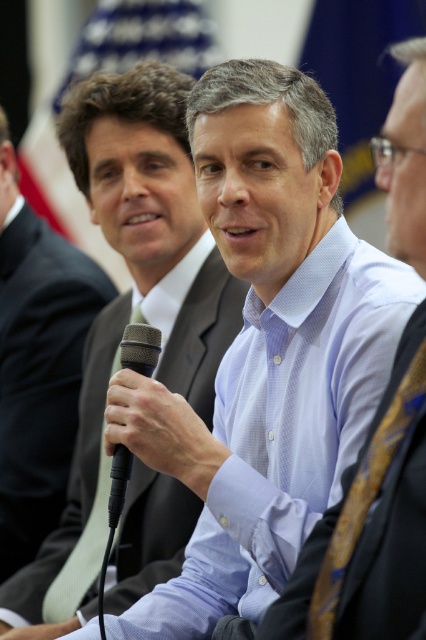
Question: Considering the relative positions of dark gray suit at center and matte black microphone at center in the image provided, where is dark gray suit at center located with respect to matte black microphone at center?

Choices:
 (A) left
 (B) right

Answer: (B)

Question: Considering the real-world distances, which object is farthest from the dark gray suit at center?

Choices:
 (A) light blue textured shirt at center
 (B) black matte microphone at center
 (C) matte black microphone at center

Answer: (A)

Question: Considering the relative positions of light blue textured shirt at center and dark gray suit at center in the image provided, where is light blue textured shirt at center located with respect to dark gray suit at center?

Choices:
 (A) below
 (B) above

Answer: (B)

Question: Among these points, which one is nearest to the camera?

Choices:
 (A) (155, 339)
 (B) (13, 568)
 (C) (356, 492)

Answer: (C)

Question: Which of the following is the closest to the observer?

Choices:
 (A) (420, 387)
 (B) (112, 497)
 (C) (408, 129)
 (D) (141, 538)

Answer: (A)

Question: Does light blue textured shirt at center appear under black matte microphone at center?

Choices:
 (A) yes
 (B) no

Answer: (B)